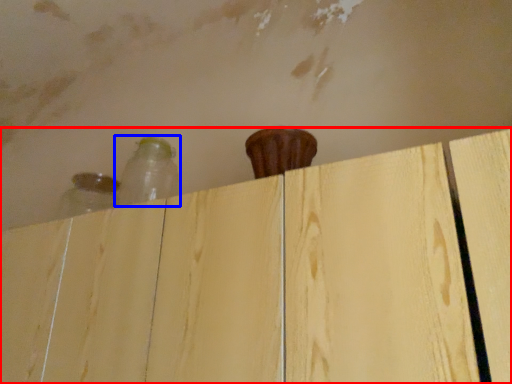
Question: Which point is further to the camera, dresser (highlighted by a red box) or bottle (highlighted by a blue box)?

Choices:
 (A) dresser
 (B) bottle

Answer: (B)